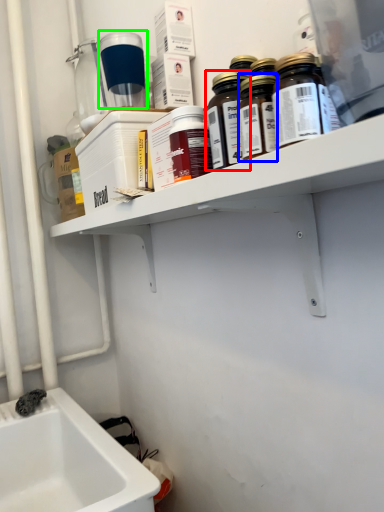
Question: Considering the real-world distances, which object is closest to bottle (highlighted by a red box)? bottle (highlighted by a blue box) or bottle (highlighted by a green box).

Choices:
 (A) bottle
 (B) bottle

Answer: (A)